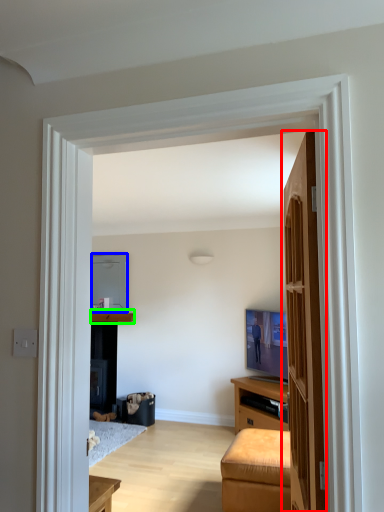
Question: Based on their relative distances, which object is farther from door (highlighted by a red box)? Choose from appliance (highlighted by a blue box) and cabinetry (highlighted by a green box).

Choices:
 (A) appliance
 (B) cabinetry

Answer: (A)